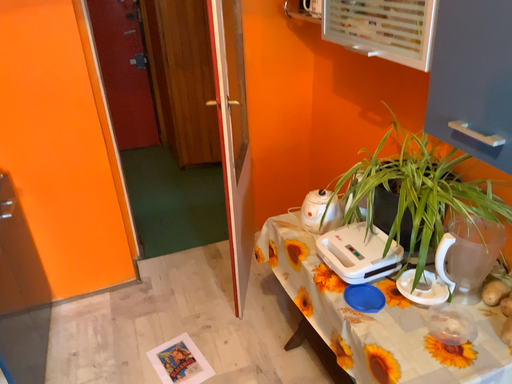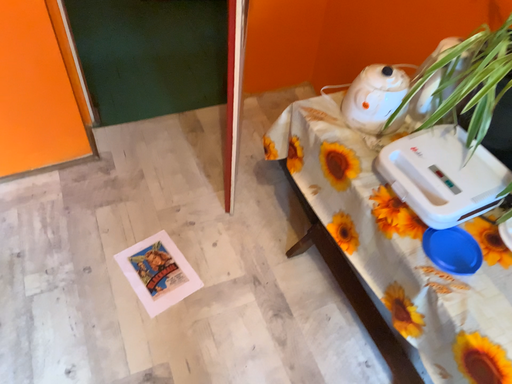
Question: Which way did the camera rotate in the video?

Choices:
 (A) rotated upward
 (B) rotated downward

Answer: (B)